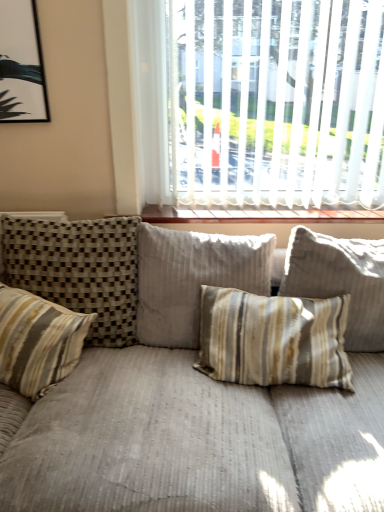
The width and height of the screenshot is (384, 512). I want to click on free region under white blinds at upper center (from a real-world perspective), so click(x=272, y=206).